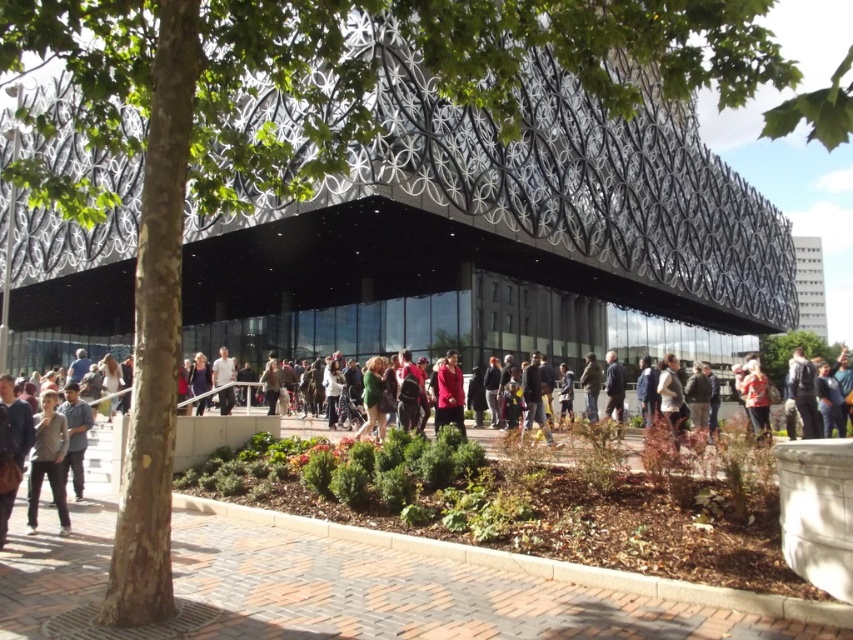
Question: Can you confirm if gray cotton shirt at lower left is smaller than dark blue jacket at center?

Choices:
 (A) yes
 (B) no

Answer: (A)

Question: Can you confirm if gray cotton shirt at lower left is positioned above matte red coat at center?

Choices:
 (A) yes
 (B) no

Answer: (B)

Question: Is gray cotton shirt at lower left bigger than dark blue jacket at center?

Choices:
 (A) yes
 (B) no

Answer: (B)

Question: Which point is farther from the camera taking this photo?

Choices:
 (A) [438, 426]
 (B) [762, 380]
 (C) [608, 413]
 (D) [808, 376]

Answer: (C)

Question: Which of these objects is positioned farthest from the green fabric jacket at center?

Choices:
 (A) gray cotton shirt at lower left
 (B) matte red coat at center

Answer: (A)

Question: Among these points, which one is nearest to the camera?

Choices:
 (A) (51, 401)
 (B) (749, 408)
 (C) (660, 394)
 (D) (589, 352)

Answer: (A)